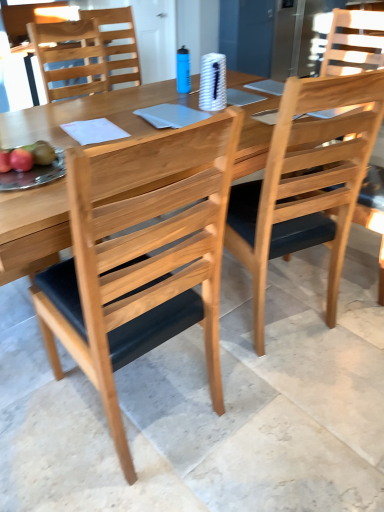
Where is `vacant space to the right of shiny red apple at left, arranged as the 1th fruit when viewed from the front`? vacant space to the right of shiny red apple at left, arranged as the 1th fruit when viewed from the front is located at coordinates (50, 173).